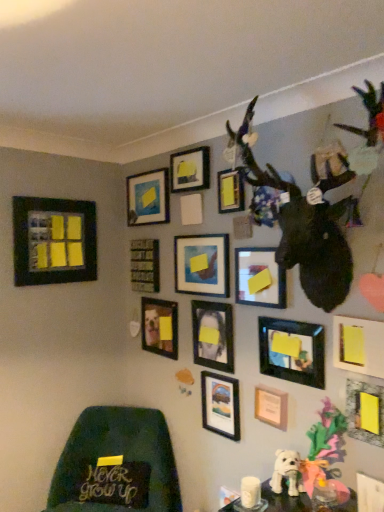
Question: Can you confirm if white plush dog at lower center is positioned to the right of matte black fabric at lower left?

Choices:
 (A) yes
 (B) no

Answer: (A)

Question: Can you confirm if white plush dog at lower center is taller than matte black fabric at lower left?

Choices:
 (A) yes
 (B) no

Answer: (A)

Question: Can you confirm if white plush dog at lower center is positioned to the left of matte black fabric at lower left?

Choices:
 (A) no
 (B) yes

Answer: (A)

Question: Can you confirm if white plush dog at lower center is thinner than matte black fabric at lower left?

Choices:
 (A) no
 (B) yes

Answer: (A)

Question: Is white plush dog at lower center positioned behind matte black fabric at lower left?

Choices:
 (A) no
 (B) yes

Answer: (A)

Question: Is white plush dog at lower center outside matte black fabric at lower left?

Choices:
 (A) no
 (B) yes

Answer: (B)

Question: Does yellow matte picture frame at lower right, which is the 1th picture frame from right to left, have a greater height compared to matte black photo frame at center, positioned as the 9th picture frame in right-to-left order?

Choices:
 (A) no
 (B) yes

Answer: (A)

Question: Are yellow matte picture frame at lower right, which is the 1th picture frame from right to left, and matte black photo frame at center, the 7th picture frame in the left-to-right sequence, beside each other?

Choices:
 (A) no
 (B) yes

Answer: (A)

Question: From a real-world perspective, is yellow matte picture frame at lower right, which is the 1th picture frame from right to left, under matte black photo frame at center, positioned as the 9th picture frame in right-to-left order?

Choices:
 (A) no
 (B) yes

Answer: (B)

Question: Is yellow matte picture frame at lower right, which is the 1th picture frame from right to left, not near matte black photo frame at center, positioned as the 9th picture frame in right-to-left order?

Choices:
 (A) no
 (B) yes

Answer: (A)

Question: Is yellow matte picture frame at lower right, which is the 1th picture frame from right to left, smaller than matte black photo frame at center, the 7th picture frame in the left-to-right sequence?

Choices:
 (A) yes
 (B) no

Answer: (A)

Question: Can you confirm if yellow matte picture frame at lower right, arranged as the 15th picture frame when viewed from the left, is bigger than matte black photo frame at center, the 7th picture frame in the left-to-right sequence?

Choices:
 (A) yes
 (B) no

Answer: (B)

Question: From a real-world perspective, is matte black picture frame at center, marked as the sixth picture frame in a right-to-left arrangement, physically below matte wooden picture frame at center, acting as the 4th picture frame starting from the left?

Choices:
 (A) no
 (B) yes

Answer: (A)